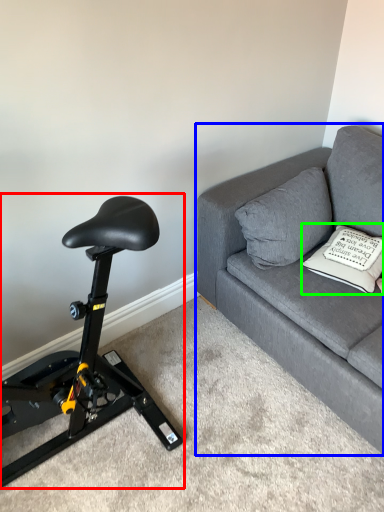
Question: Based on their relative distances, which object is farther from stationary bicycle (highlighted by a red box)? Choose from studio couch (highlighted by a blue box) and pillow (highlighted by a green box).

Choices:
 (A) studio couch
 (B) pillow

Answer: (B)